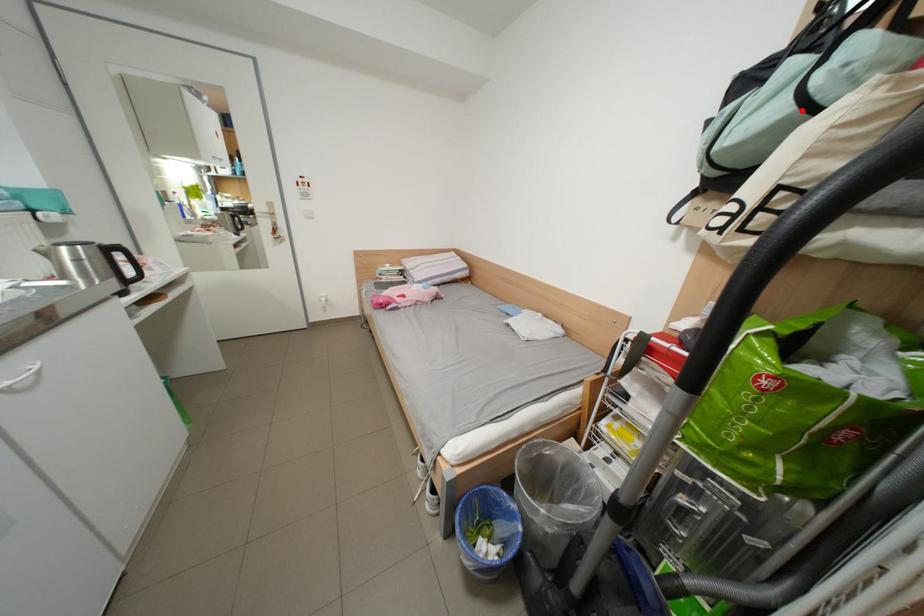
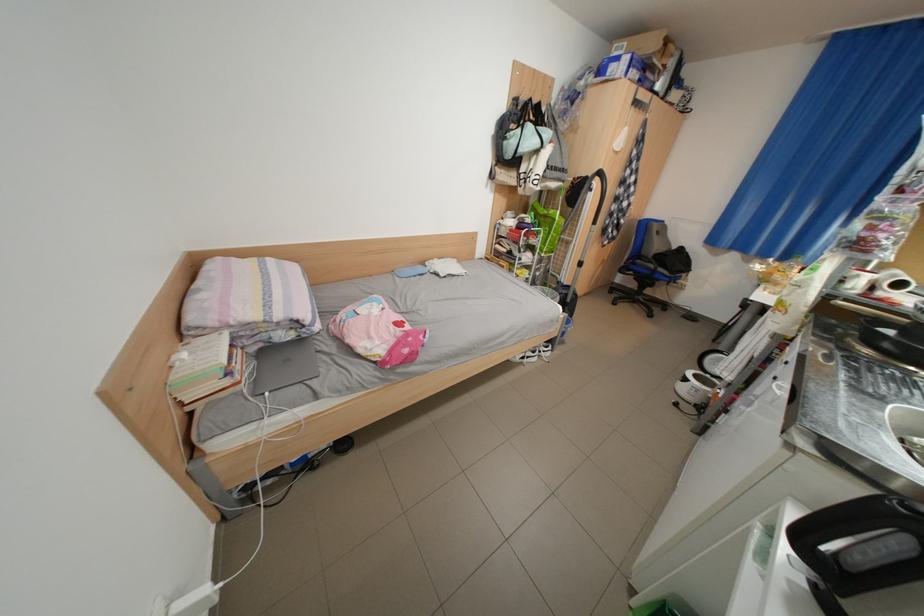
Locate, in the second image, the point that corresponds to the highlighted location in the first image.

(552, 147)